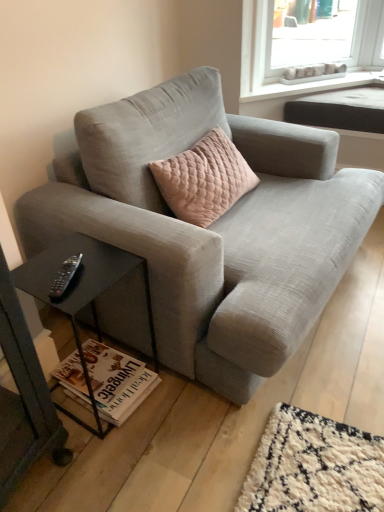
Question: Does white plastic tray at upper right, which is counted as the first window sill, starting from the back, have a lesser width compared to black glass table at lower left?

Choices:
 (A) no
 (B) yes

Answer: (B)

Question: Can you confirm if white plastic tray at upper right, which is counted as the first window sill, starting from the back, is smaller than black glass table at lower left?

Choices:
 (A) no
 (B) yes

Answer: (B)

Question: Can you confirm if white plastic tray at upper right, which is counted as the first window sill, starting from the back, is taller than black glass table at lower left?

Choices:
 (A) no
 (B) yes

Answer: (A)

Question: Is white plastic tray at upper right, which is the second window sill in front-to-back order, outside black glass table at lower left?

Choices:
 (A) no
 (B) yes

Answer: (B)

Question: Is white plastic tray at upper right, which is the second window sill in front-to-back order, at the right side of black glass table at lower left?

Choices:
 (A) yes
 (B) no

Answer: (A)

Question: Do you think light gray fabric couch at center is within white paper magazine at lower left, or outside of it?

Choices:
 (A) outside
 (B) inside

Answer: (A)

Question: From the image's perspective, is light gray fabric couch at center located above or below white paper magazine at lower left?

Choices:
 (A) below
 (B) above

Answer: (B)

Question: Considering their positions, is light gray fabric couch at center located in front of or behind white paper magazine at lower left?

Choices:
 (A) behind
 (B) front

Answer: (B)

Question: Is light gray fabric couch at center to the left or to the right of white paper magazine at lower left in the image?

Choices:
 (A) right
 (B) left

Answer: (A)

Question: In terms of height, does black plastic remote at lower left look taller or shorter compared to light gray fabric couch at center?

Choices:
 (A) tall
 (B) short

Answer: (B)

Question: From the image's perspective, is black plastic remote at lower left located above or below light gray fabric couch at center?

Choices:
 (A) below
 (B) above

Answer: (A)

Question: Is point (74, 257) closer or farther from the camera than point (178, 296)?

Choices:
 (A) closer
 (B) farther

Answer: (A)

Question: From a real-world perspective, is black plastic remote at lower left positioned above or below light gray fabric couch at center?

Choices:
 (A) below
 (B) above

Answer: (B)

Question: Is white plastic tray at upper right, which is counted as the first window sill, starting from the back, to the left or to the right of white matte window sill at upper center, which ranks as the second window sill in back-to-front order, in the image?

Choices:
 (A) left
 (B) right

Answer: (A)

Question: Is white plastic tray at upper right, which is counted as the first window sill, starting from the back, in front of or behind white matte window sill at upper center, positioned as the 1th window sill in front-to-back order, in the image?

Choices:
 (A) front
 (B) behind

Answer: (B)